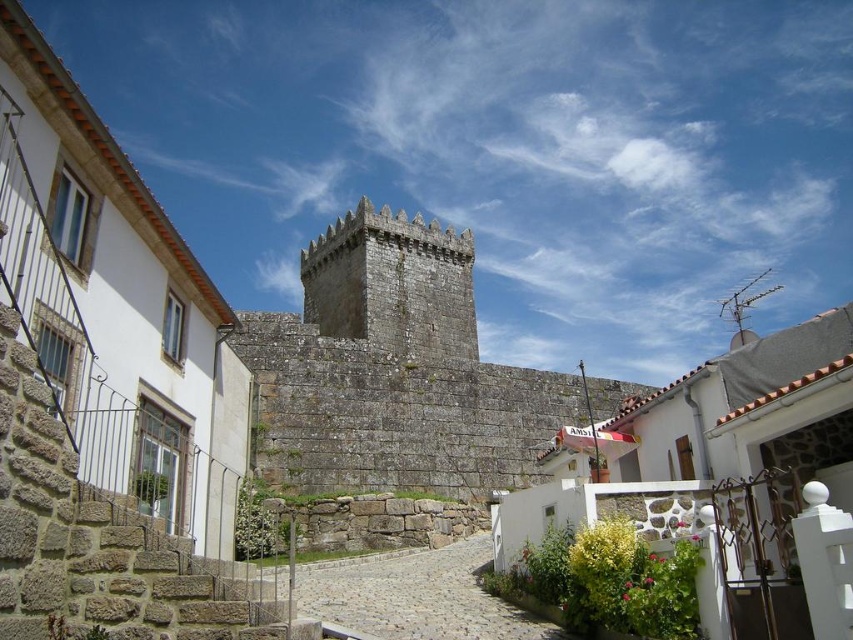
Which is behind, point (471, 480) or point (312, 572)?

Point (471, 480)

Between point (467, 355) and point (466, 627), which one is positioned behind?

Positioned behind is point (467, 355).

I want to click on rustic stone castle at center, so click(392, 371).